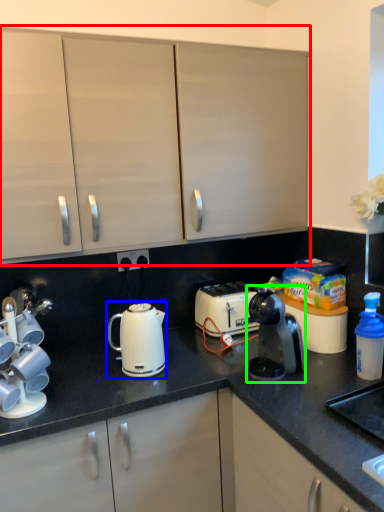
Question: Which object is positioned closest to cabinetry (highlighted by a red box)? Select from kettle (highlighted by a blue box) and home appliance (highlighted by a green box).

Choices:
 (A) kettle
 (B) home appliance

Answer: (A)